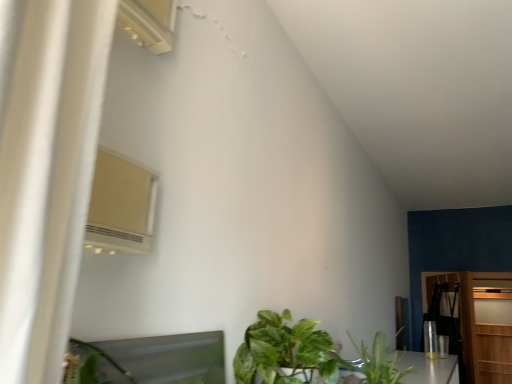
You are a GUI agent. You are given a task and a screenshot of the screen. Output one action in this format:
    pyautogui.click(x=<x>, y=<y>)
    Task: Click on the green leafy plant at lower center, the 2th houseplant in the left-to-right sequence
    The width and height of the screenshot is (512, 384).
    Given the screenshot: What is the action you would take?
    pyautogui.click(x=377, y=362)

This screenshot has width=512, height=384. What do you see at coordinates (377, 362) in the screenshot?
I see `green leafy plant at lower center, arranged as the first houseplant when viewed from the right` at bounding box center [377, 362].

Image resolution: width=512 pixels, height=384 pixels. Identify the location of white plastic air conditioner at upper left. (149, 23).

Measure the distance between white plastic air conditioner at upper left and camera.

white plastic air conditioner at upper left is 26.93 inches away from camera.

What is the approximate width of wooden dresser at right?

wooden dresser at right is 3.97 inches in width.

Describe the element at coordinates (487, 326) in the screenshot. I see `wooden door at right` at that location.

You are a GUI agent. You are given a task and a screenshot of the screen. Output one action in this format:
    pyautogui.click(x=<x>, y=<y>)
    Task: Click on the wooden door at right
    The height and width of the screenshot is (384, 512).
    Given the screenshot: What is the action you would take?
    pyautogui.click(x=487, y=326)

What do you see at coordinates (285, 351) in the screenshot? I see `green leafy plant at lower center, marked as the 1th houseplant in a left-to-right arrangement` at bounding box center [285, 351].

Find the location of `green leafy plant at lower center, the 2th houseplant in the left-to-right sequence`. green leafy plant at lower center, the 2th houseplant in the left-to-right sequence is located at coordinates (377, 362).

Considering their positions, is white plastic air conditioner at upper left located in front of or behind wooden dresser at right?

Clearly, white plastic air conditioner at upper left is in front of wooden dresser at right.

Is there a large distance between white plastic air conditioner at upper left and wooden dresser at right?

white plastic air conditioner at upper left is far away from wooden dresser at right.

Which of these two, white plastic air conditioner at upper left or wooden dresser at right, is wider?

With larger width is wooden dresser at right.

Considering the points (161, 13) and (438, 300), which point is in front, point (161, 13) or point (438, 300)?

The point (161, 13) is closer.

Would you say green leafy plant at lower center, arranged as the first houseplant when viewed from the right, contains green leafy plant at lower center, acting as the second houseplant starting from the right?

Definitely not — green leafy plant at lower center, acting as the second houseplant starting from the right, is not inside green leafy plant at lower center, arranged as the first houseplant when viewed from the right.

Is there a large distance between green leafy plant at lower center, the 2th houseplant in the left-to-right sequence, and green leafy plant at lower center, marked as the 1th houseplant in a left-to-right arrangement?

No, green leafy plant at lower center, the 2th houseplant in the left-to-right sequence, is not far from green leafy plant at lower center, marked as the 1th houseplant in a left-to-right arrangement.

Is green leafy plant at lower center, arranged as the first houseplant when viewed from the right, taller or shorter than green leafy plant at lower center, marked as the 1th houseplant in a left-to-right arrangement?

Considering their sizes, green leafy plant at lower center, arranged as the first houseplant when viewed from the right, has less height than green leafy plant at lower center, marked as the 1th houseplant in a left-to-right arrangement.

Is white plastic air conditioner at upper left completely or partially outside of green leafy plant at lower center, arranged as the first houseplant when viewed from the right?

Indeed, white plastic air conditioner at upper left is completely outside green leafy plant at lower center, arranged as the first houseplant when viewed from the right.

Locate an element on the screen. Image resolution: width=512 pixels, height=384 pixels. air conditioner that is on the left side of green leafy plant at lower center, the 2th houseplant in the left-to-right sequence is located at coordinates (149, 23).

Which is less distant, (169, 50) or (389, 362)?

Point (169, 50) is closer to the camera than point (389, 362).

In terms of size, does white plastic air conditioner at upper left appear bigger or smaller than green leafy plant at lower center, arranged as the first houseplant when viewed from the right?

Considering their sizes, white plastic air conditioner at upper left takes up less space than green leafy plant at lower center, arranged as the first houseplant when viewed from the right.

In the scene shown: From a real-world perspective, is wooden dresser at right positioned above or below green leafy plant at lower center, marked as the 1th houseplant in a left-to-right arrangement?

In terms of real-world spatial position, wooden dresser at right is below green leafy plant at lower center, marked as the 1th houseplant in a left-to-right arrangement.

Who is bigger, wooden dresser at right or green leafy plant at lower center, acting as the second houseplant starting from the right?

Bigger between the two is wooden dresser at right.

Considering the positions of objects wooden dresser at right and green leafy plant at lower center, acting as the second houseplant starting from the right, in the image provided, who is more to the right, wooden dresser at right or green leafy plant at lower center, acting as the second houseplant starting from the right,?

wooden dresser at right.

From the image's perspective, starting from the wooden dresser at right, which houseplant is the 2nd one above? Please provide its 2D coordinates.

[(285, 351)]

Between green leafy plant at lower center, the 2th houseplant in the left-to-right sequence, and white plastic air conditioner at upper left, which one has larger size?

Bigger between the two is green leafy plant at lower center, the 2th houseplant in the left-to-right sequence.

Would you say green leafy plant at lower center, the 2th houseplant in the left-to-right sequence, is outside white plastic air conditioner at upper left?

Yes, green leafy plant at lower center, the 2th houseplant in the left-to-right sequence, is located beyond the bounds of white plastic air conditioner at upper left.

Can you confirm if green leafy plant at lower center, the 2th houseplant in the left-to-right sequence, is positioned to the right of white plastic air conditioner at upper left?

Correct, you'll find green leafy plant at lower center, the 2th houseplant in the left-to-right sequence, to the right of white plastic air conditioner at upper left.

Does green leafy plant at lower center, arranged as the first houseplant when viewed from the right, touch white plastic air conditioner at upper left?

No, green leafy plant at lower center, arranged as the first houseplant when viewed from the right, is not next to white plastic air conditioner at upper left.

Is green leafy plant at lower center, marked as the 1th houseplant in a left-to-right arrangement, bigger or smaller than green leafy plant at lower center, the 2th houseplant in the left-to-right sequence?

In the image, green leafy plant at lower center, marked as the 1th houseplant in a left-to-right arrangement, appears to be larger than green leafy plant at lower center, the 2th houseplant in the left-to-right sequence.

Is green leafy plant at lower center, acting as the second houseplant starting from the right, taller than green leafy plant at lower center, the 2th houseplant in the left-to-right sequence?

Indeed, green leafy plant at lower center, acting as the second houseplant starting from the right, has a greater height compared to green leafy plant at lower center, the 2th houseplant in the left-to-right sequence.

From the image's perspective, is green leafy plant at lower center, acting as the second houseplant starting from the right, above green leafy plant at lower center, the 2th houseplant in the left-to-right sequence?

Yes, from the image's perspective, green leafy plant at lower center, acting as the second houseplant starting from the right, is above green leafy plant at lower center, the 2th houseplant in the left-to-right sequence.

How different are the orientations of green leafy plant at lower center, marked as the 1th houseplant in a left-to-right arrangement, and green leafy plant at lower center, arranged as the first houseplant when viewed from the right, in degrees?

green leafy plant at lower center, marked as the 1th houseplant in a left-to-right arrangement, and green leafy plant at lower center, arranged as the first houseplant when viewed from the right, are facing 2.29 degrees away from each other.

From a real-world perspective, is wooden door at right above or below green leafy plant at lower center, acting as the second houseplant starting from the right?

wooden door at right is situated lower than green leafy plant at lower center, acting as the second houseplant starting from the right, in the real world.

Could you tell me if wooden door at right is turned towards green leafy plant at lower center, marked as the 1th houseplant in a left-to-right arrangement?

Yes, wooden door at right faces towards green leafy plant at lower center, marked as the 1th houseplant in a left-to-right arrangement.

Does wooden door at right have a lesser width compared to green leafy plant at lower center, marked as the 1th houseplant in a left-to-right arrangement?

Correct, the width of wooden door at right is less than that of green leafy plant at lower center, marked as the 1th houseplant in a left-to-right arrangement.

Where is `air conditioner above the wooden dresser at right (from the image's perspective)`? air conditioner above the wooden dresser at right (from the image's perspective) is located at coordinates coord(149,23).

Identify the location of houseplant located below the green leafy plant at lower center, marked as the 1th houseplant in a left-to-right arrangement (from the image's perspective). The height and width of the screenshot is (384, 512). (377, 362).

From the picture: Considering their positions, is wooden door at right positioned further to white plastic air conditioner at upper left than green leafy plant at lower center, the 2th houseplant in the left-to-right sequence?

Among the two, wooden door at right is located further to white plastic air conditioner at upper left.

Which object lies further to the anchor point green leafy plant at lower center, the 2th houseplant in the left-to-right sequence, wooden dresser at right or wooden door at right?

wooden dresser at right is positioned further to the anchor green leafy plant at lower center, the 2th houseplant in the left-to-right sequence.

Which object lies further to the anchor point white plastic air conditioner at upper left, wooden dresser at right or green leafy plant at lower center, arranged as the first houseplant when viewed from the right?

wooden dresser at right.

From the image, which object appears to be farther from white plastic air conditioner at upper left, green leafy plant at lower center, acting as the second houseplant starting from the right, or wooden dresser at right?

wooden dresser at right is further to white plastic air conditioner at upper left.

Which object lies further to the anchor point white plastic air conditioner at upper left, wooden door at right or wooden dresser at right?

The object further to white plastic air conditioner at upper left is wooden dresser at right.

Considering their positions, is wooden dresser at right positioned further to green leafy plant at lower center, acting as the second houseplant starting from the right, than green leafy plant at lower center, the 2th houseplant in the left-to-right sequence?

wooden dresser at right lies further to green leafy plant at lower center, acting as the second houseplant starting from the right, than the other object.

Consider the image. Estimate the real-world distances between objects in this image. Which object is further from wooden dresser at right, green leafy plant at lower center, marked as the 1th houseplant in a left-to-right arrangement, or white plastic air conditioner at upper left?

The object further to wooden dresser at right is white plastic air conditioner at upper left.

Which object lies further to the anchor point green leafy plant at lower center, arranged as the first houseplant when viewed from the right, wooden dresser at right or green leafy plant at lower center, marked as the 1th houseplant in a left-to-right arrangement?

Among the two, wooden dresser at right is located further to green leafy plant at lower center, arranged as the first houseplant when viewed from the right.

Find the location of a particular element. The width and height of the screenshot is (512, 384). dresser between green leafy plant at lower center, the 2th houseplant in the left-to-right sequence, and wooden door at right in the front-back direction is located at coordinates (474, 321).

This screenshot has width=512, height=384. I want to click on dresser located between white plastic air conditioner at upper left and wooden door at right in the depth direction, so click(x=474, y=321).

The width and height of the screenshot is (512, 384). Identify the location of houseplant between white plastic air conditioner at upper left and green leafy plant at lower center, the 2th houseplant in the left-to-right sequence, in the up-down direction. (285, 351).

Locate an element on the screen. The image size is (512, 384). houseplant located between green leafy plant at lower center, acting as the second houseplant starting from the right, and wooden dresser at right in the depth direction is located at coordinates (377, 362).